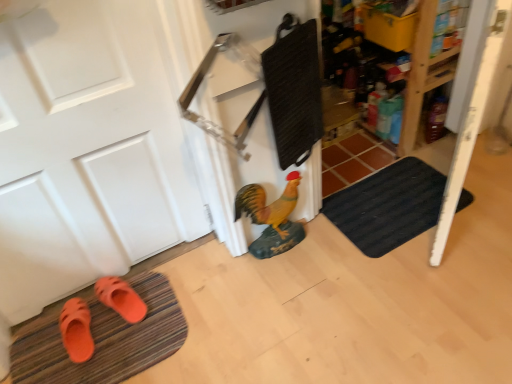
Question: Is orange rubber sandals at lower left, the first footwear viewed from the left, positioned behind orange rubber slipper at lower left, which ranks as the 2th footwear in left-to-right order?

Choices:
 (A) yes
 (B) no

Answer: (B)

Question: Is the position of orange rubber sandals at lower left, the first footwear viewed from the left, less distant than that of orange rubber slipper at lower left, which ranks as the 2th footwear in left-to-right order?

Choices:
 (A) yes
 (B) no

Answer: (A)

Question: From the image's perspective, does orange rubber sandals at lower left, the first footwear viewed from the left, appear lower than orange rubber slipper at lower left, which ranks as the 2th footwear in left-to-right order?

Choices:
 (A) yes
 (B) no

Answer: (A)

Question: Is orange rubber sandals at lower left, the first footwear viewed from the left, turned away from orange rubber slipper at lower left, arranged as the 1th footwear when viewed from the right?

Choices:
 (A) yes
 (B) no

Answer: (B)

Question: Is orange rubber sandals at lower left, the first footwear viewed from the left, to the left of orange rubber slipper at lower left, arranged as the 1th footwear when viewed from the right, from the viewer's perspective?

Choices:
 (A) no
 (B) yes

Answer: (B)

Question: Is orange rubber sandals at lower left, the 2th footwear viewed from the right, facing towards orange rubber slipper at lower left, which ranks as the 2th footwear in left-to-right order?

Choices:
 (A) yes
 (B) no

Answer: (B)

Question: Is black textured bath mat at lower right, the second bath mat positioned from the left, shorter than orange rubber slipper at lower left, arranged as the 1th footwear when viewed from the right?

Choices:
 (A) no
 (B) yes

Answer: (B)

Question: From a real-world perspective, does black textured bath mat at lower right, which appears as the 1th bath mat when viewed from the right, stand above orange rubber slipper at lower left, which ranks as the 2th footwear in left-to-right order?

Choices:
 (A) no
 (B) yes

Answer: (A)

Question: Is black textured bath mat at lower right, positioned as the first bath mat in top-to-bottom order, wider than orange rubber slipper at lower left, which ranks as the 2th footwear in left-to-right order?

Choices:
 (A) no
 (B) yes

Answer: (B)

Question: From a real-world perspective, is black textured bath mat at lower right, which appears as the 1th bath mat when viewed from the right, located beneath orange rubber slipper at lower left, which ranks as the 2th footwear in left-to-right order?

Choices:
 (A) no
 (B) yes

Answer: (B)

Question: From the image's perspective, is black textured bath mat at lower right, the second bath mat positioned from the left, on orange rubber slipper at lower left, arranged as the 1th footwear when viewed from the right?

Choices:
 (A) yes
 (B) no

Answer: (A)

Question: Is black textured bath mat at lower right, marked as the 2th bath mat in a bottom-to-top arrangement, outside orange rubber slipper at lower left, arranged as the 1th footwear when viewed from the right?

Choices:
 (A) no
 (B) yes

Answer: (B)

Question: Is orange rubber bath mat at lower left, which appears as the second bath mat when viewed from the top, positioned before orange rubber sandals at lower left, the 2th footwear viewed from the right?

Choices:
 (A) yes
 (B) no

Answer: (A)